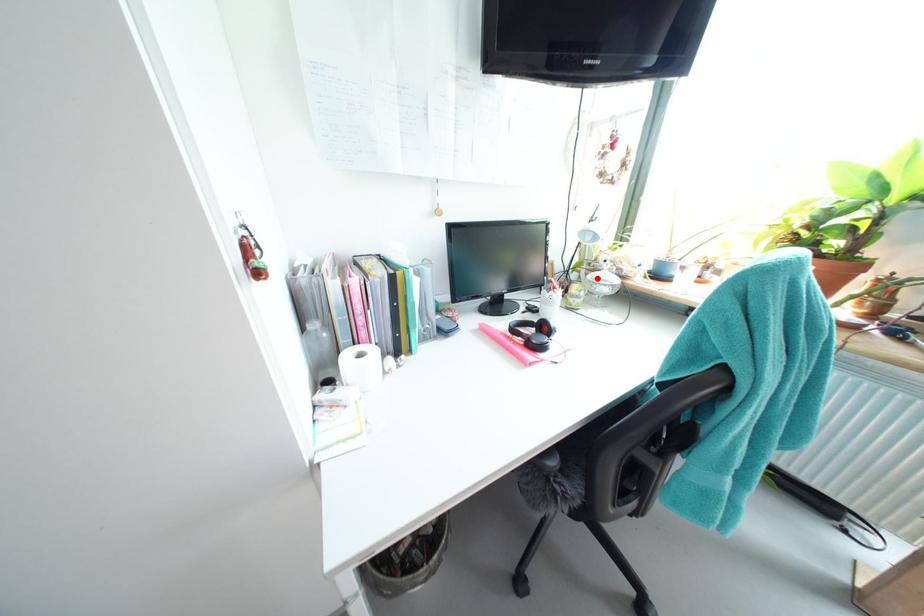
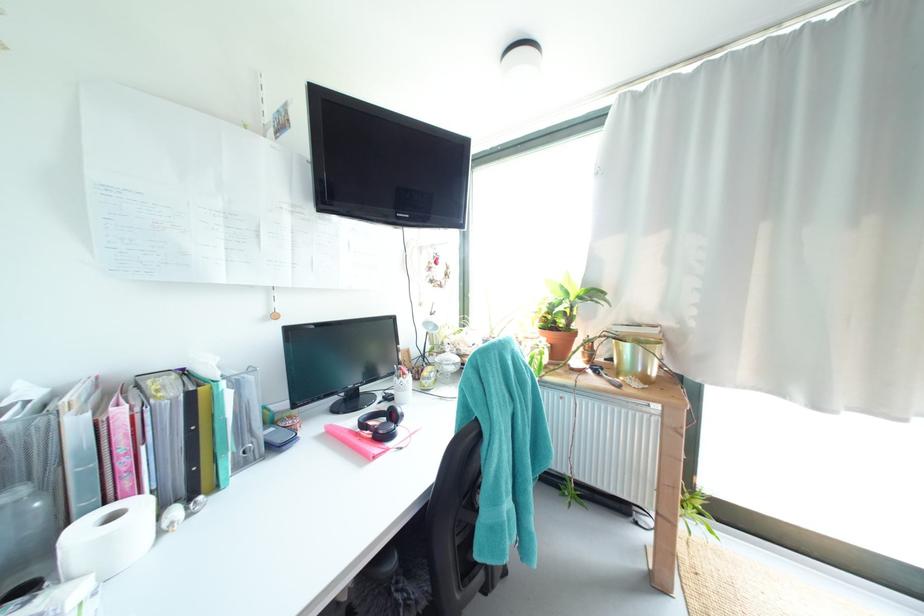
The point at the highlighted location is marked in the first image. Where is the corresponding point in the second image?

(445, 361)